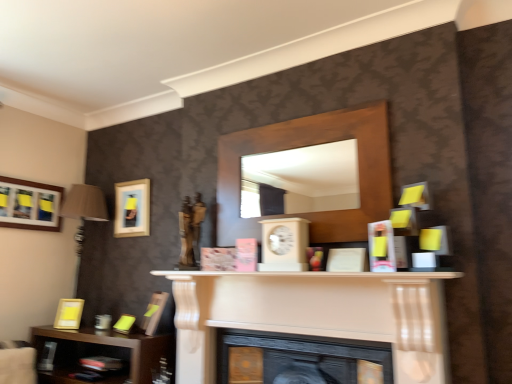
Identify the location of vacant space underneath wooden mirror at center, placed as the second shelf when sorted from bottom to top (from a real-world perspective). (269, 336).